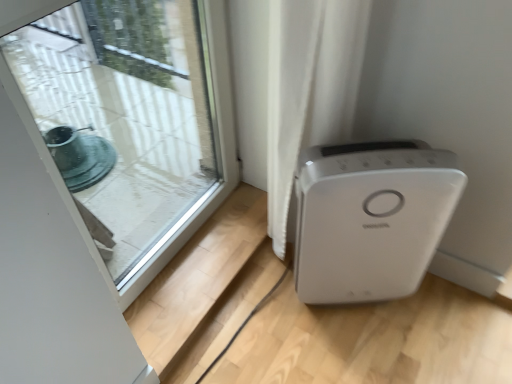
What do you see at coordinates (370, 218) in the screenshot? Image resolution: width=512 pixels, height=384 pixels. I see `white plastic air purifier at lower right` at bounding box center [370, 218].

Where is `white plastic air purifier at lower right`? The image size is (512, 384). white plastic air purifier at lower right is located at coordinates (370, 218).

Image resolution: width=512 pixels, height=384 pixels. Identify the location of white plastic air purifier at lower right. click(x=370, y=218).